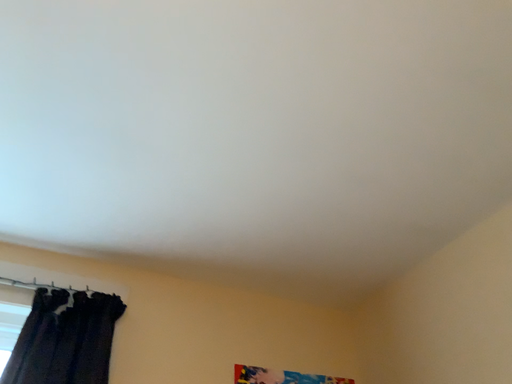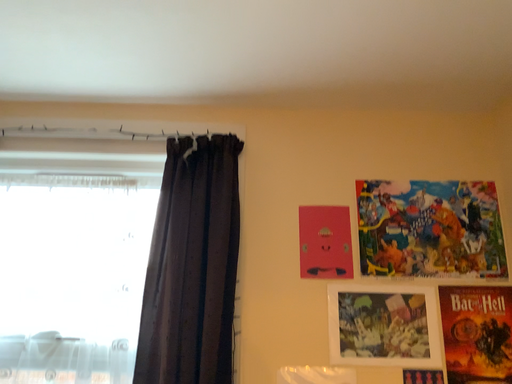
Question: Which way did the camera rotate in the video?

Choices:
 (A) rotated upward
 (B) rotated downward

Answer: (B)